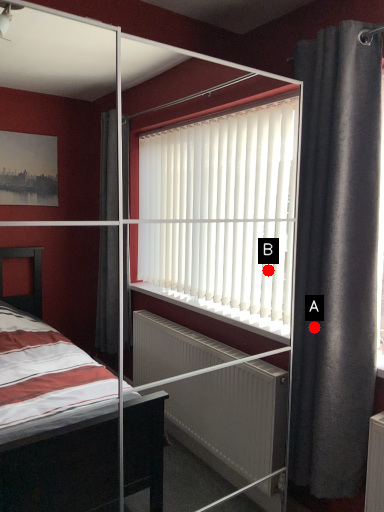
Question: Two points are circled on the image, labeled by A and B beside each circle. Among these points, which one is nearest to the camera?

Choices:
 (A) A is closer
 (B) B is closer

Answer: (A)